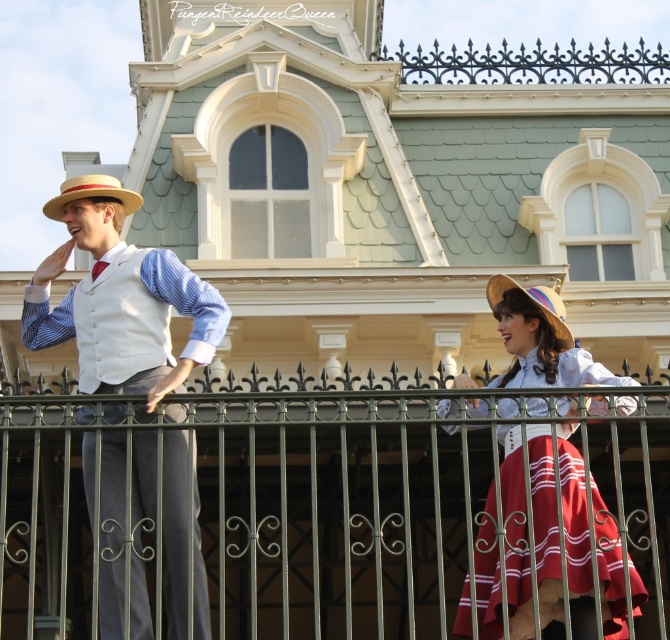
Is point (580, 458) farther from camera compared to point (127, 211)?

No, (580, 458) is in front of (127, 211).

Can you confirm if matte red skirt at center is taller than straw textured cowboy hat at left?

Yes.

Who is more forward, (521, 586) or (62, 188)?

Positioned in front is point (521, 586).

Find the location of `matte red skirt at center`. matte red skirt at center is located at coordinates coord(588,548).

Is matte red skirt at center below natural straw hat at center?

Correct, matte red skirt at center is located below natural straw hat at center.

Can you confirm if matte red skirt at center is taller than natural straw hat at center?

Correct, matte red skirt at center is much taller as natural straw hat at center.

Is point (529, 301) farther from viewer compared to point (543, 291)?

No, (529, 301) is closer to viewer.

Locate an element on the screen. The image size is (670, 640). matte red skirt at center is located at coordinates (588, 548).

Which of these two, green wrought iron fence at center or straw textured cowboy hat at left, stands taller?

green wrought iron fence at center

Which of these two, green wrought iron fence at center or straw textured cowboy hat at left, stands shorter?

straw textured cowboy hat at left is shorter.

Which is in front, point (314, 595) or point (52, 204)?

Point (314, 595) is more forward.

Find the location of a particular element. The width and height of the screenshot is (670, 640). green wrought iron fence at center is located at coordinates click(338, 512).